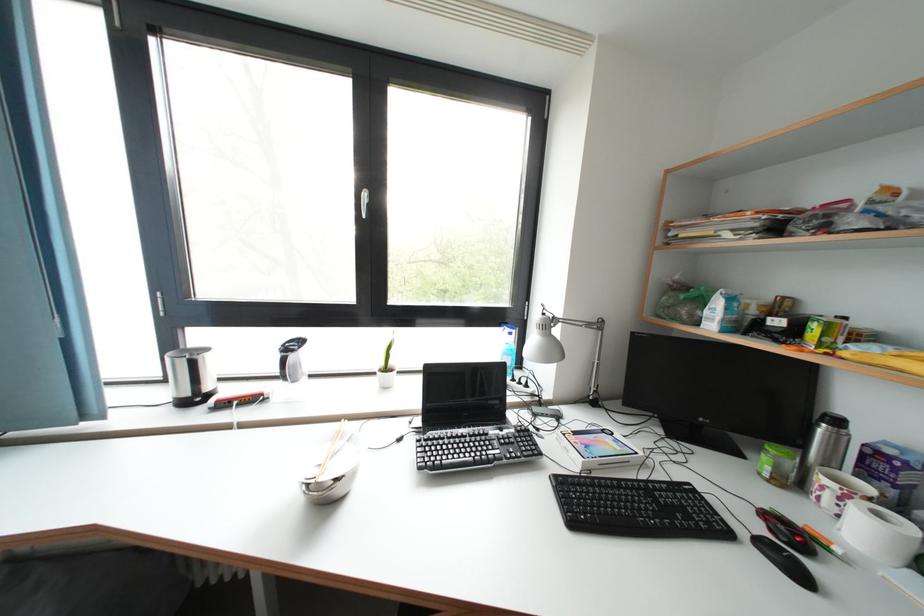
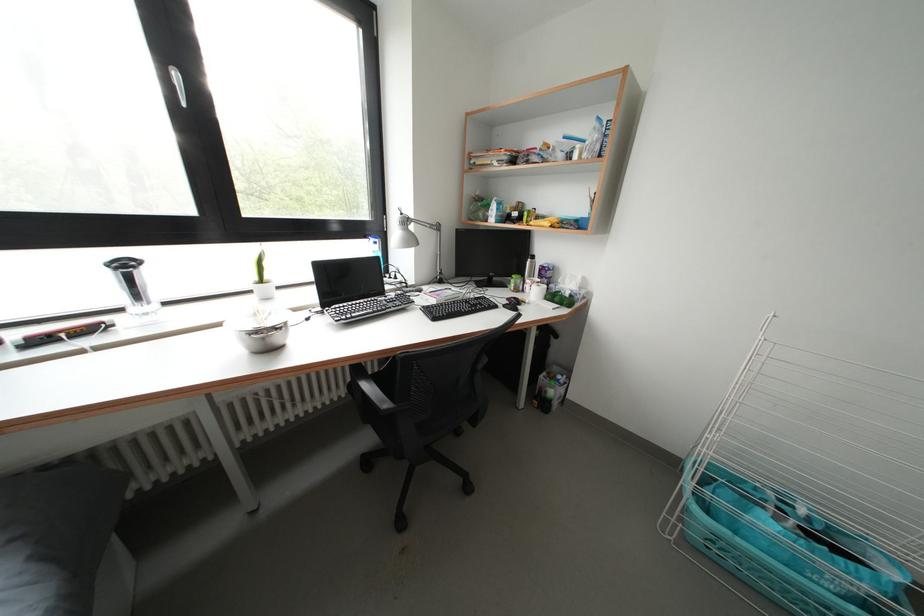
In the second image, find the point that corresponds to point (506, 331) in the first image.

(371, 241)